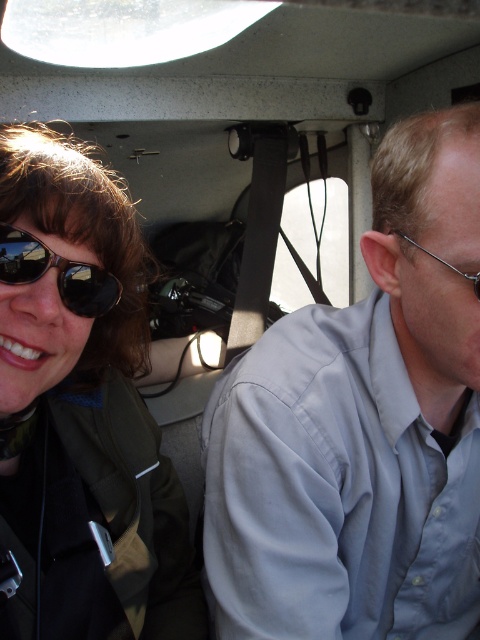
Is point (320, 592) positioned in front of point (477, 278)?

No, it is behind (477, 278).

Which is above, light blue shirt at center or clear plastic glasses at right?

clear plastic glasses at right is above.

Image resolution: width=480 pixels, height=640 pixels. I want to click on light blue shirt at center, so click(x=361, y=426).

Who is higher up, light blue shirt at center or matte black sunglasses at upper left?

matte black sunglasses at upper left

Is light blue shirt at center in front of matte black sunglasses at upper left?

No.

Is point (249, 444) in front of point (68, 508)?

No, it is not.

Locate an element on the screen. The height and width of the screenshot is (640, 480). light blue shirt at center is located at coordinates (361, 426).

From the picture: Is black reflective sunglasses at left further to the viewer compared to clear plastic glasses at right?

No, it is in front of clear plastic glasses at right.

Is black reflective sunglasses at left below clear plastic glasses at right?

Indeed, black reflective sunglasses at left is positioned under clear plastic glasses at right.

Who is more forward, (7, 228) or (478, 294)?

Point (7, 228)

Identify the location of black reflective sunglasses at left. (58, 273).